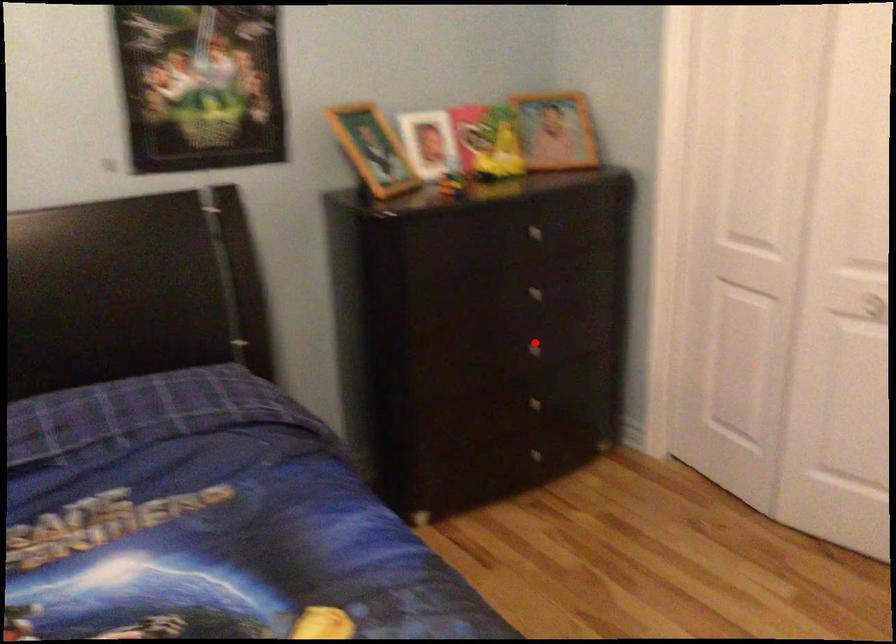
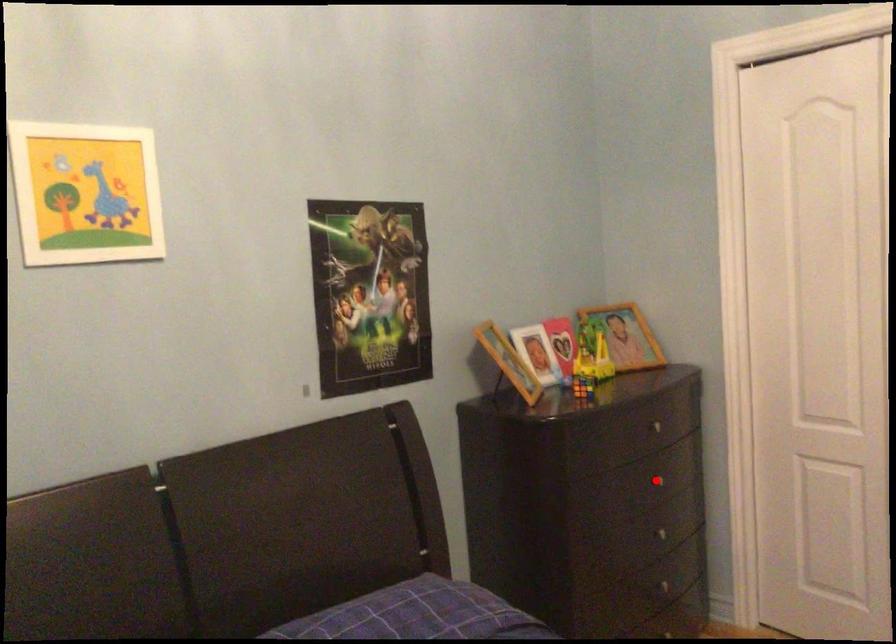
I am providing you with two images of the same scene from different viewpoints. A red point is marked on the first image and another point is marked on the second image. Does the point marked in image1 correspond to the same location as the one in image2?

No